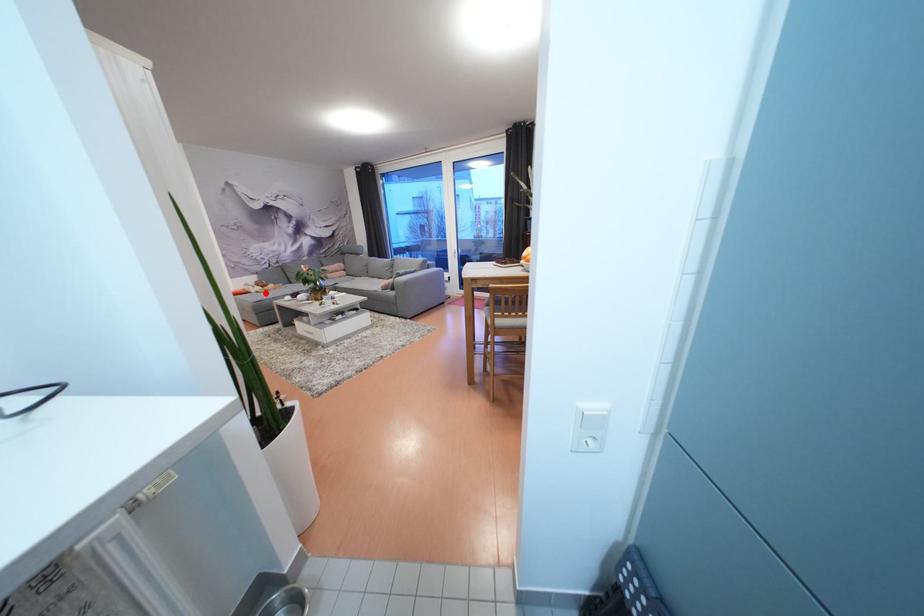
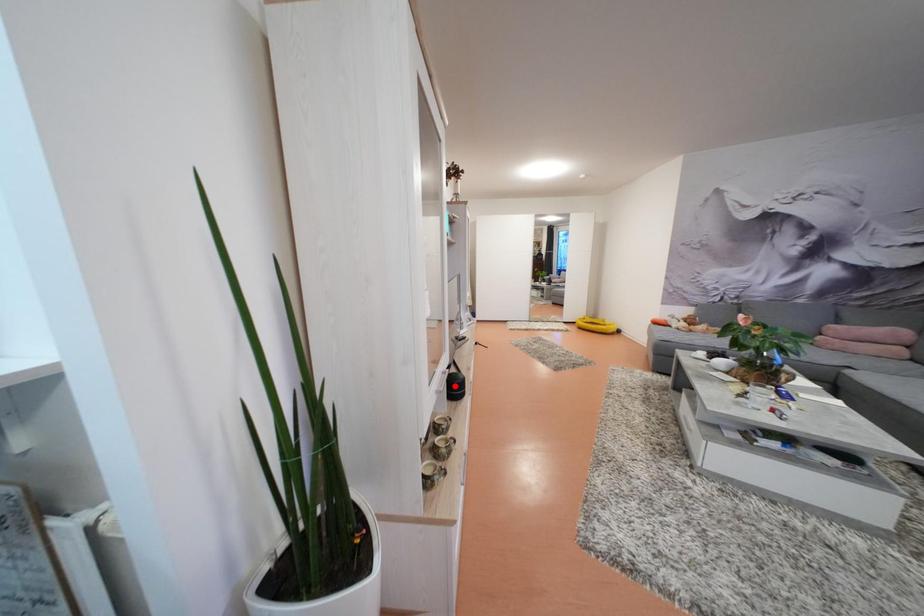
I am providing you with two images of the same scene from different viewpoints. A red point is marked on the first image and another point is marked on the second image. Is the marked point in image1 the same physical position as the marked point in image2?

No